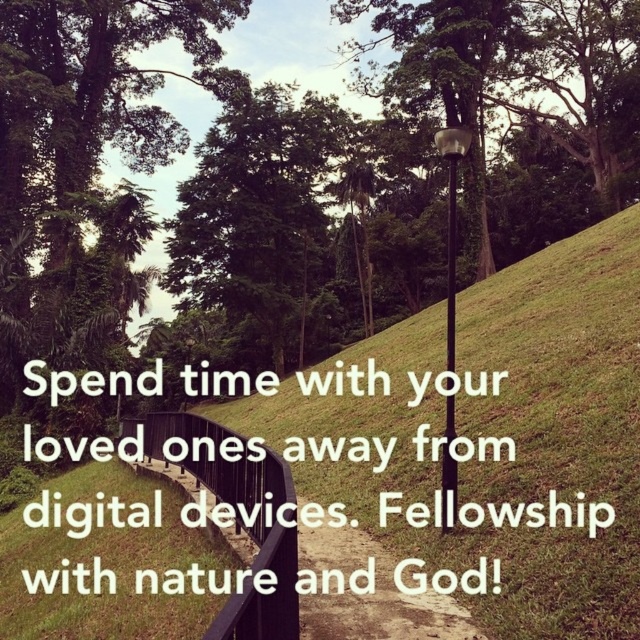
Question: Does black metal lamp post at center appear on the left side of metallic pole at center?

Choices:
 (A) no
 (B) yes

Answer: (A)

Question: Among these objects, which one is farthest from the camera?

Choices:
 (A) black metal lamp post at center
 (B) metallic pole at center

Answer: (B)

Question: Which of the following is the closest to the observer?

Choices:
 (A) black metal lamp post at center
 (B) metallic pole at center
 (C) black metal path at center

Answer: (C)

Question: Does black metal path at center appear under black metal lamp post at center?

Choices:
 (A) yes
 (B) no

Answer: (A)

Question: Is black metal path at center positioned in front of black metal lamp post at center?

Choices:
 (A) no
 (B) yes

Answer: (B)

Question: Among these objects, which one is nearest to the camera?

Choices:
 (A) black metal lamp post at center
 (B) metallic pole at center

Answer: (A)